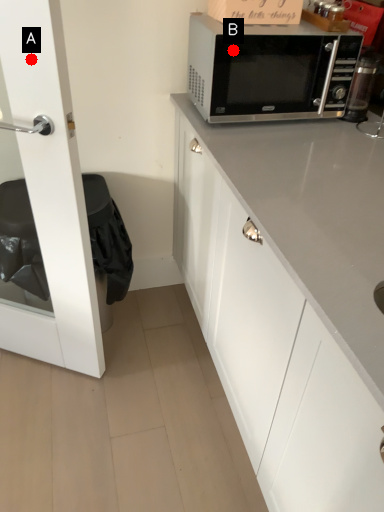
Question: Two points are circled on the image, labeled by A and B beside each circle. Which point appears closest to the camera in this image?

Choices:
 (A) A is closer
 (B) B is closer

Answer: (A)